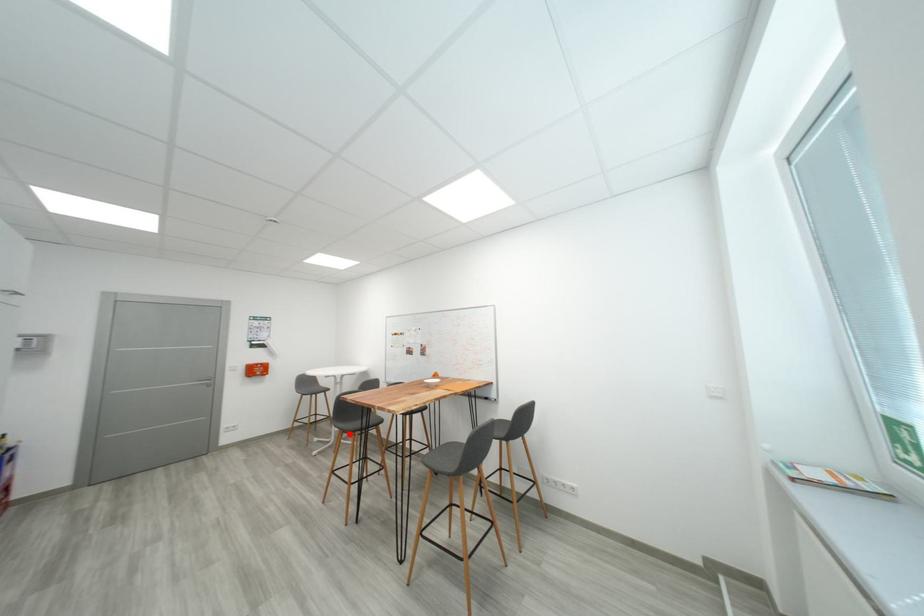
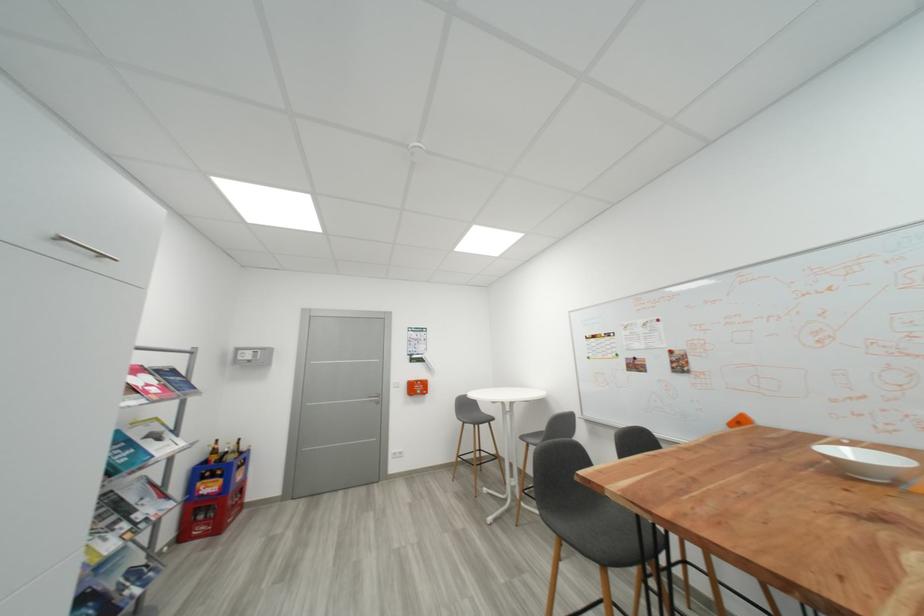
Where in the second image is the point corresponding to the highlighted location from the first image?

(568, 539)